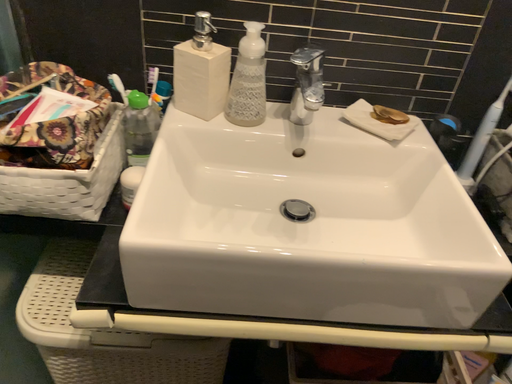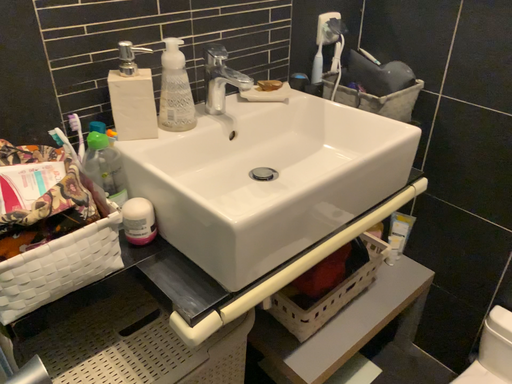
Question: How did the camera likely rotate when shooting the video?

Choices:
 (A) rotated right
 (B) rotated left

Answer: (A)